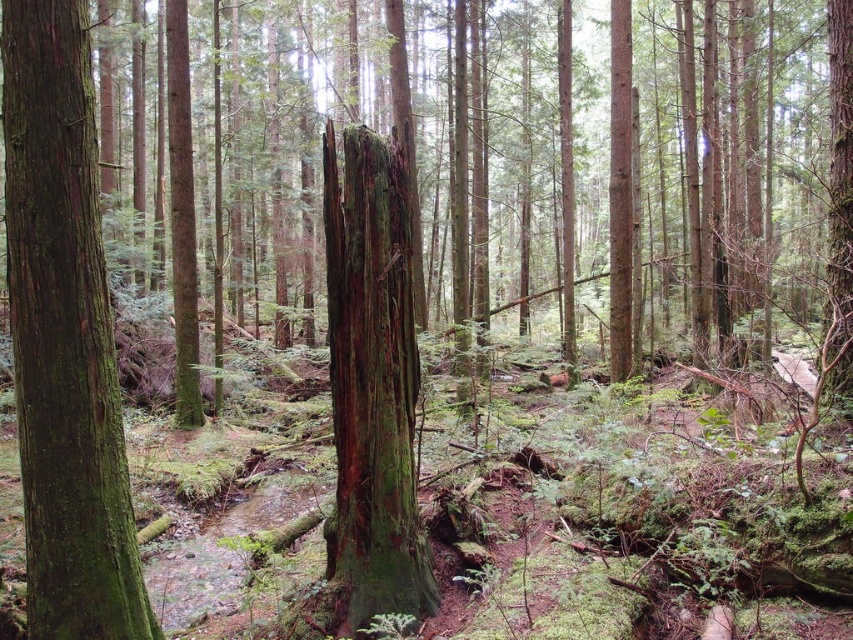
Question: Does green rough bark tree trunk at left appear over green mossy tree trunk at center?

Choices:
 (A) yes
 (B) no

Answer: (A)

Question: Which point is farther from the camera taking this photo?

Choices:
 (A) (357, 422)
 (B) (76, 492)

Answer: (A)

Question: Which of the following is the farthest from the observer?

Choices:
 (A) green rough bark tree trunk at left
 (B) green mossy tree trunk at center

Answer: (B)

Question: Can you confirm if green rough bark tree trunk at left is smaller than green mossy tree trunk at center?

Choices:
 (A) no
 (B) yes

Answer: (B)

Question: Which of the following is the closest to the observer?

Choices:
 (A) (25, 115)
 (B) (361, 589)

Answer: (A)

Question: Does green rough bark tree trunk at left have a greater width compared to green mossy tree trunk at center?

Choices:
 (A) no
 (B) yes

Answer: (A)